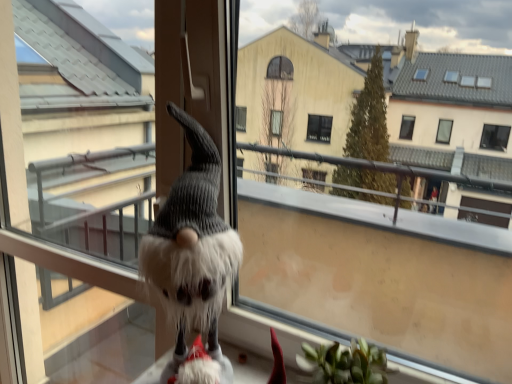
Describe the element at coordinates (192, 247) in the screenshot. This screenshot has width=512, height=384. I see `fluffy white gnome at center` at that location.

What do you see at coordinates (99, 204) in the screenshot? I see `fuzzy gray screen door at center` at bounding box center [99, 204].

You are a GUI agent. You are given a task and a screenshot of the screen. Output one action in this format:
    pyautogui.click(x=<x>, y=<y>)
    Task: Click on the fluffy white gnome at center
    Image resolution: width=512 pixels, height=384 pixels.
    Given the screenshot: What is the action you would take?
    pyautogui.click(x=192, y=247)

Considering the relative sizes of fluffy white gnome at center and fuzzy fabric gnome at lower left in the image provided, is fluffy white gnome at center taller than fuzzy fabric gnome at lower left?

In fact, fluffy white gnome at center may be shorter than fuzzy fabric gnome at lower left.

Which of these two, fluffy white gnome at center or fuzzy fabric gnome at lower left, is bigger?

fuzzy fabric gnome at lower left.

Is the position of fluffy white gnome at center less distant than that of fuzzy fabric gnome at lower left?

No, the depth of fluffy white gnome at center is greater than that of fuzzy fabric gnome at lower left.

Is fluffy white gnome at center turned away from fuzzy fabric gnome at lower left?

Absolutely, fluffy white gnome at center is directed away from fuzzy fabric gnome at lower left.

From the image's perspective, is fluffy white gnome at center located beneath fuzzy gray screen door at center?

Actually, fluffy white gnome at center appears above fuzzy gray screen door at center in the image.

From the picture: From a real-world perspective, is fluffy white gnome at center physically above fuzzy gray screen door at center?

Yes, from a real-world perspective, fluffy white gnome at center is above fuzzy gray screen door at center.

Where is `animal on the right of fuzzy gray screen door at center`? The width and height of the screenshot is (512, 384). animal on the right of fuzzy gray screen door at center is located at coordinates (192, 247).

Looking at their sizes, would you say fluffy white gnome at center is wider or thinner than fuzzy gray screen door at center?

Considering their sizes, fluffy white gnome at center looks broader than fuzzy gray screen door at center.

Is fuzzy gray screen door at center further to the viewer compared to fluffy white gnome at center?

Yes, fuzzy gray screen door at center is further from the camera.

Is fuzzy gray screen door at center inside the boundaries of fluffy white gnome at center, or outside?

fuzzy gray screen door at center is outside fluffy white gnome at center.

In terms of width, does fuzzy gray screen door at center look wider or thinner when compared to fluffy white gnome at center?

In the image, fuzzy gray screen door at center appears to be more narrow than fluffy white gnome at center.

Locate an element on the screen. screen door below the fuzzy fabric gnome at lower left (from the image's perspective) is located at coordinates (99, 204).

Is fuzzy fabric gnome at lower left oriented towards fuzzy gray screen door at center?

No, fuzzy fabric gnome at lower left is not aimed at fuzzy gray screen door at center.

Between fuzzy fabric gnome at lower left and fuzzy gray screen door at center, which one has more height?

Standing taller between the two is fuzzy gray screen door at center.

Is point (336, 181) more distant than point (64, 78)?

Yes, it is behind point (64, 78).

Relative to fluffy white gnome at center, is fuzzy fabric gnome at lower left in front or behind?

Clearly, fuzzy fabric gnome at lower left is in front of fluffy white gnome at center.

From a real-world perspective, is fuzzy fabric gnome at lower left positioned above or below fluffy white gnome at center?

Clearly, from a real-world perspective, fuzzy fabric gnome at lower left is above fluffy white gnome at center.

Is fuzzy fabric gnome at lower left far away from fluffy white gnome at center?

No, fuzzy fabric gnome at lower left is in close proximity to fluffy white gnome at center.

Who is shorter, fuzzy fabric gnome at lower left or fluffy white gnome at center?

fluffy white gnome at center.

Could you tell me if fuzzy gray screen door at center is turned towards fuzzy fabric gnome at lower left?

No, fuzzy gray screen door at center is not oriented towards fuzzy fabric gnome at lower left.

Does fuzzy gray screen door at center come in front of fuzzy fabric gnome at lower left?

That is False.

Considering the relative sizes of fuzzy gray screen door at center and fuzzy fabric gnome at lower left in the image provided, is fuzzy gray screen door at center thinner than fuzzy fabric gnome at lower left?

Correct, the width of fuzzy gray screen door at center is less than that of fuzzy fabric gnome at lower left.

Do you think fuzzy gray screen door at center is within fuzzy fabric gnome at lower left, or outside of it?

fuzzy gray screen door at center lies outside fuzzy fabric gnome at lower left.

This screenshot has width=512, height=384. There is a fluffy white gnome at center. Find the location of `window screen above it (from a real-world perspective)`. window screen above it (from a real-world perspective) is located at coordinates (382, 205).

Find the location of a particular element. This screenshot has height=384, width=512. animal that is in front of the fuzzy gray screen door at center is located at coordinates (192, 247).

Which object lies nearer to the anchor point fuzzy fabric gnome at lower left, fuzzy gray screen door at center or fluffy white gnome at center?

fuzzy gray screen door at center.

Estimate the real-world distances between objects in this image. Which object is further from fluffy white gnome at center, fuzzy fabric gnome at lower left or fuzzy gray screen door at center?

fuzzy fabric gnome at lower left lies further to fluffy white gnome at center than the other object.

Estimate the real-world distances between objects in this image. Which object is closer to fluffy white gnome at center, fuzzy gray screen door at center or fuzzy fabric gnome at lower left?

Among the two, fuzzy gray screen door at center is located nearer to fluffy white gnome at center.

Looking at this image, when comparing their distances from fuzzy fabric gnome at lower left, does fluffy white gnome at center or fuzzy gray screen door at center seem further?

fluffy white gnome at center is positioned further to the anchor fuzzy fabric gnome at lower left.

Based on the photo, from the image, which object appears to be nearer to fuzzy gray screen door at center, fuzzy fabric gnome at lower left or fluffy white gnome at center?

Among the two, fluffy white gnome at center is located nearer to fuzzy gray screen door at center.

From the image, which object appears to be nearer to fuzzy gray screen door at center, fluffy white gnome at center or fuzzy fabric gnome at lower left?

The object closer to fuzzy gray screen door at center is fluffy white gnome at center.

You are a GUI agent. You are given a task and a screenshot of the screen. Output one action in this format:
    pyautogui.click(x=<x>, y=<y>)
    Task: Click on the animal between fuzzy gray screen door at center and fuzzy fabric gnome at lower left from left to right
    This screenshot has width=512, height=384.
    Given the screenshot: What is the action you would take?
    pyautogui.click(x=192, y=247)